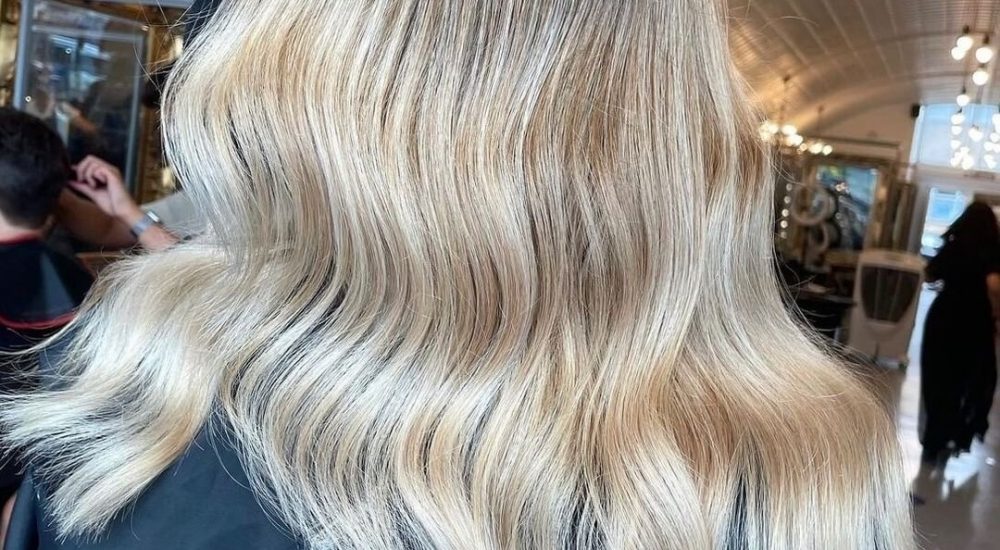
In order to click on lightbulb in this screenshot , I will do `click(788, 126)`.